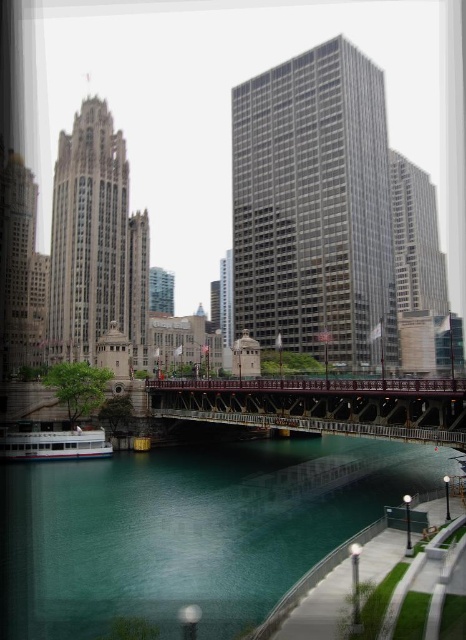
You are standing at the point with coordinates point (286, 316) and want to walk to the point point (28, 458). Given that both points are on the same path, which direction should you face to move towards your destination?

Since point (286, 316) is behind point (28, 458), you should face the direction opposite to where point (28, 458) is located to move towards it.

You are a tourist standing on the bridge and want to take a photo of the beige stone tower at left and the teal glassy river at center. Based on their positions, which object should appear closer to the front of your photo?

The teal glassy river at center is in front of the beige stone tower at left, so the river will appear closer to the front of the photo.